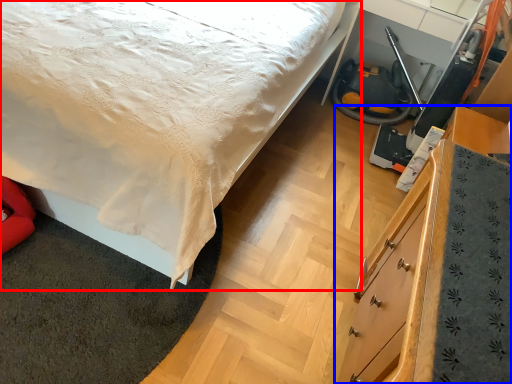
Question: Which of the following is the farthest to the observer, bed (highlighted by a red box) or chest of drawers (highlighted by a blue box)?

Choices:
 (A) bed
 (B) chest of drawers

Answer: (A)